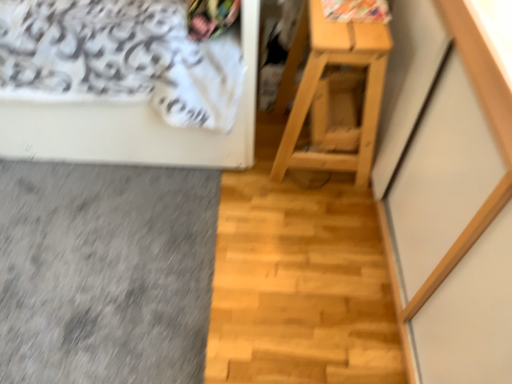
What do you see at coordinates (333, 94) in the screenshot? I see `natural wood table at right` at bounding box center [333, 94].

The width and height of the screenshot is (512, 384). What are the coordinates of `natural wood table at right` in the screenshot? It's located at pyautogui.click(x=333, y=94).

Find the location of a particular element. natural wood table at right is located at coordinates (333, 94).